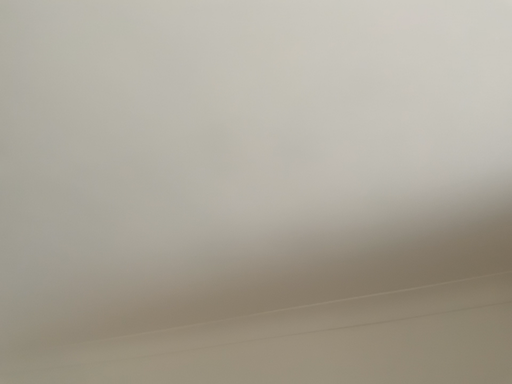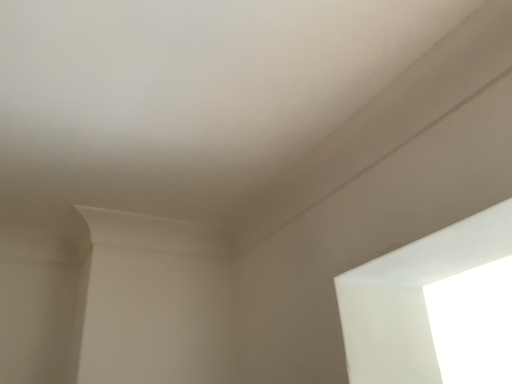
Question: How did the camera likely rotate when shooting the video?

Choices:
 (A) rotated downward
 (B) rotated upward

Answer: (A)